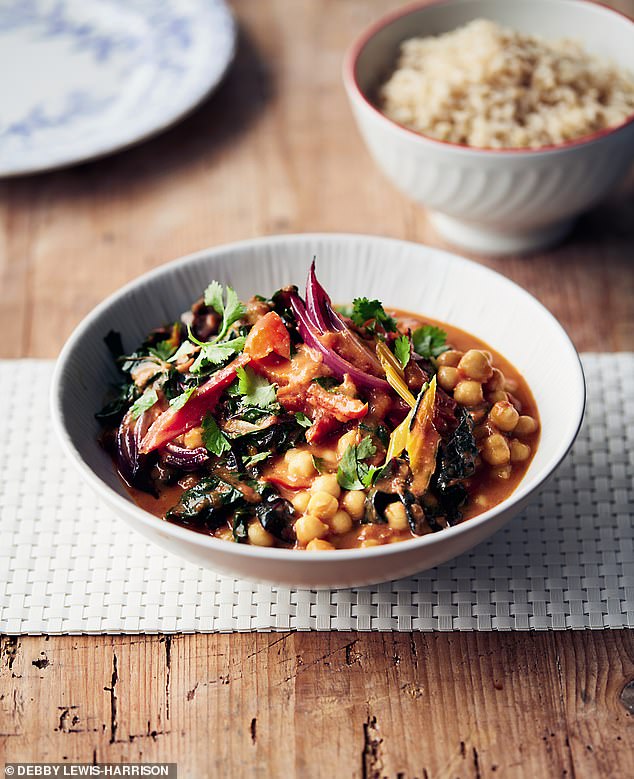
Locate an element on the screen. The height and width of the screenshot is (779, 634). placemat is located at coordinates (48, 534), (451, 603), (581, 492).